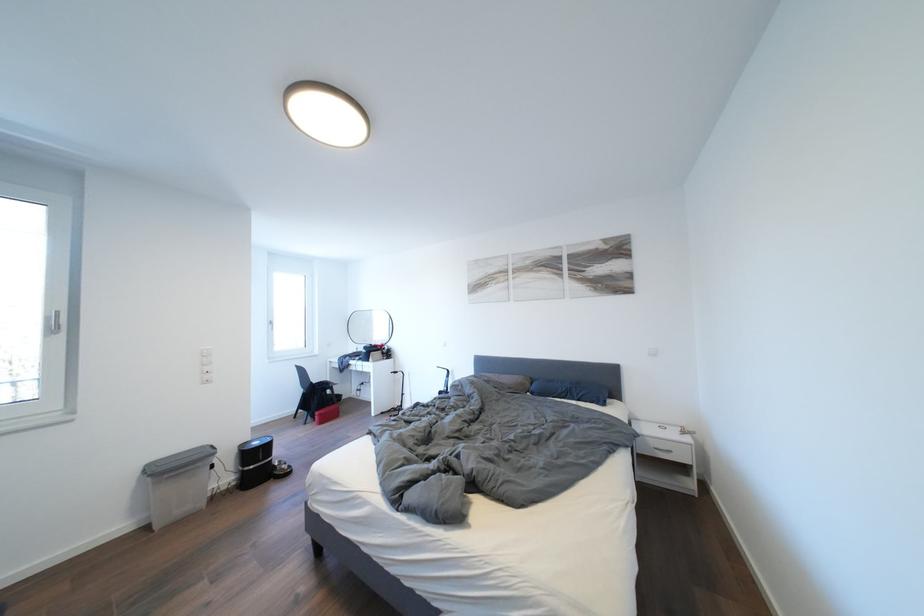
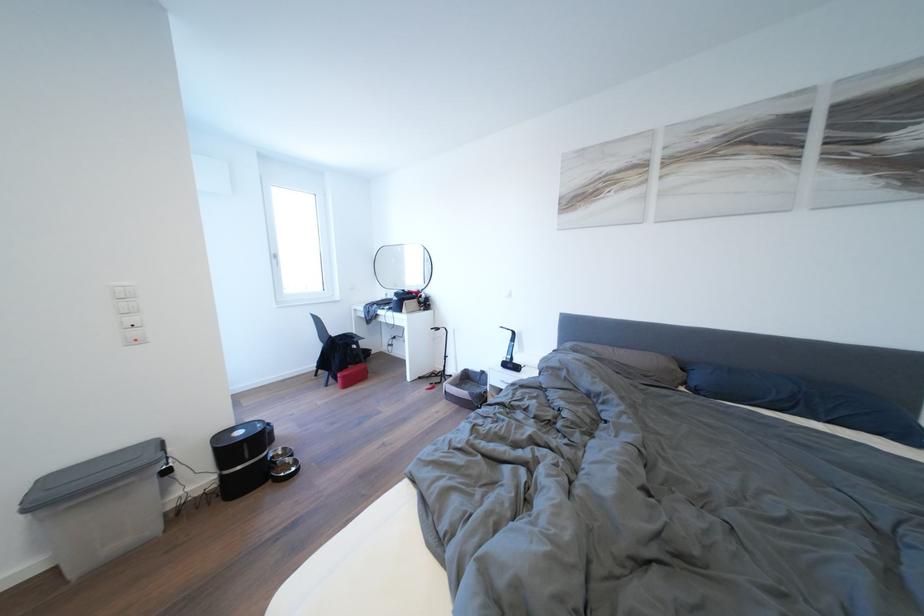
Locate, in the second image, the point that corresponds to (x=292, y=471) in the first image.

(296, 466)